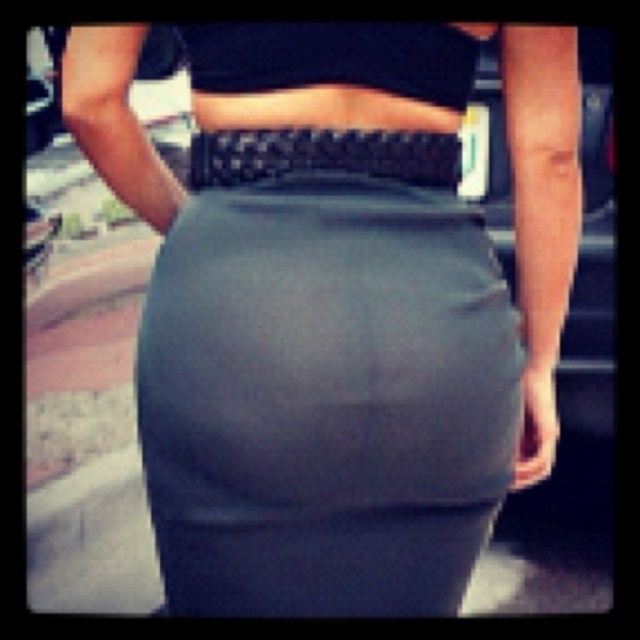
Between black matte crop top at upper center and black woven belt at center, which one has less height?

Standing shorter between the two is black woven belt at center.

Can you confirm if black matte crop top at upper center is positioned above black woven belt at center?

Indeed, black matte crop top at upper center is positioned over black woven belt at center.

Between point (432, 93) and point (225, 156), which one is positioned behind?

Point (432, 93)

Locate an element on the screen. The height and width of the screenshot is (640, 640). black matte crop top at upper center is located at coordinates pos(317,58).